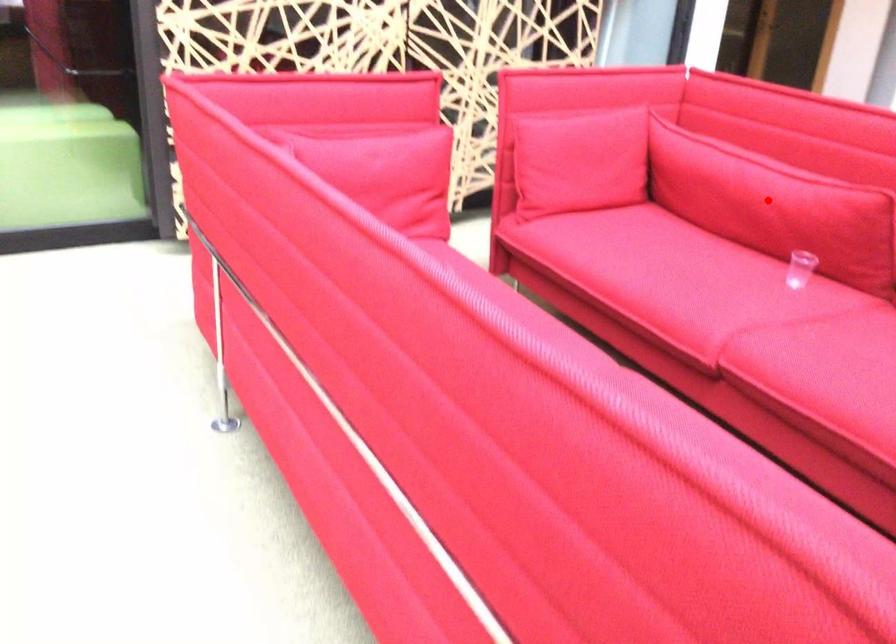
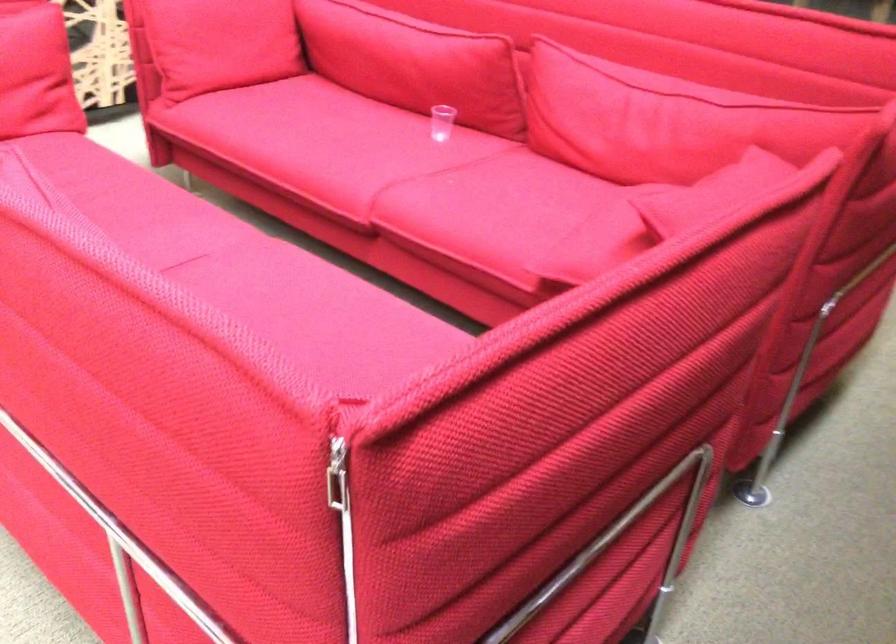
Find the pixel in the second image that matches the highlighted location in the first image.

(414, 62)